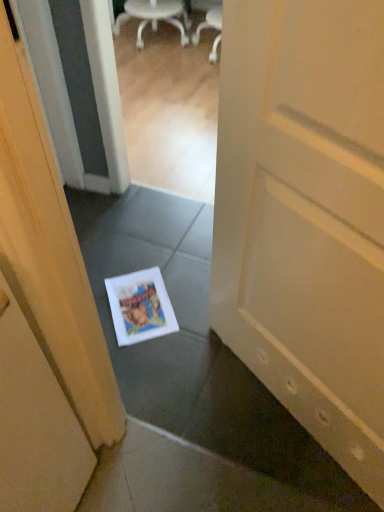
Question: From the image's perspective, is white matte door at center beneath white matte magazine at center?

Choices:
 (A) no
 (B) yes

Answer: (A)

Question: Is white matte door at center turned away from white matte magazine at center?

Choices:
 (A) no
 (B) yes

Answer: (A)

Question: From the image's perspective, does white matte door at center appear higher than white matte magazine at center?

Choices:
 (A) yes
 (B) no

Answer: (A)

Question: Is white matte magazine at center completely or partially inside white matte door at center?

Choices:
 (A) yes
 (B) no

Answer: (B)

Question: Considering the relative positions of white matte door at center and white matte magazine at center in the image provided, is white matte door at center behind white matte magazine at center?

Choices:
 (A) yes
 (B) no

Answer: (B)

Question: Does white matte door at center have a greater height compared to white matte magazine at center?

Choices:
 (A) no
 (B) yes

Answer: (B)

Question: From the image's perspective, is white plastic chair at upper center on top of white matte door at center?

Choices:
 (A) yes
 (B) no

Answer: (A)

Question: Considering the relative sizes of white plastic chair at upper center and white matte door at center in the image provided, is white plastic chair at upper center taller than white matte door at center?

Choices:
 (A) yes
 (B) no

Answer: (B)

Question: Is white plastic chair at upper center at the right side of white matte door at center?

Choices:
 (A) yes
 (B) no

Answer: (B)

Question: From a real-world perspective, is white plastic chair at upper center under white matte door at center?

Choices:
 (A) no
 (B) yes

Answer: (B)

Question: From the image's perspective, is white plastic chair at upper center beneath white matte door at center?

Choices:
 (A) no
 (B) yes

Answer: (A)

Question: Is white plastic chair at upper center thinner than white matte door at center?

Choices:
 (A) no
 (B) yes

Answer: (A)

Question: Considering the relative positions of white matte door at center and white plastic chair at upper center in the image provided, is white matte door at center to the right of white plastic chair at upper center from the viewer's perspective?

Choices:
 (A) yes
 (B) no

Answer: (A)